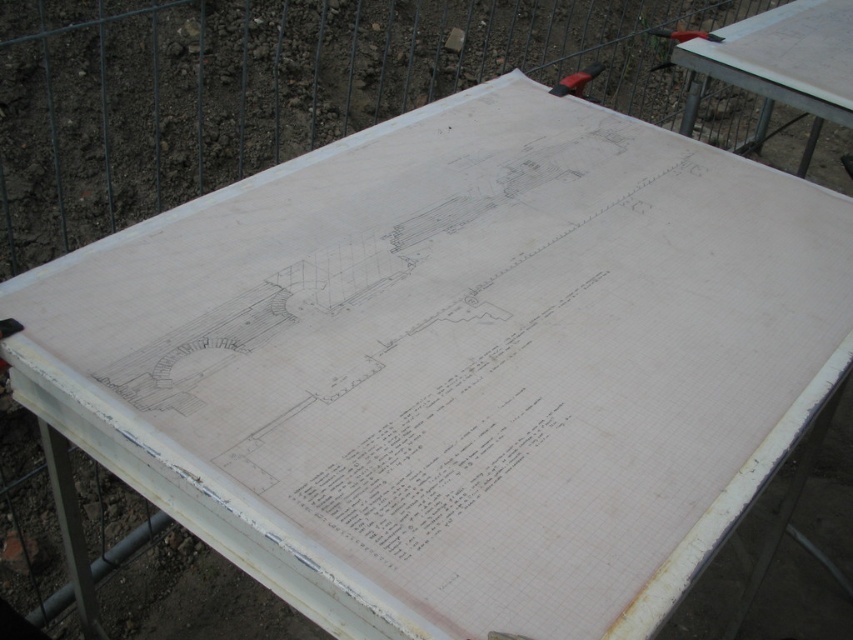
Question: Among these objects, which one is farthest from the camera?

Choices:
 (A) metallic red hammer at upper right
 (B) white paper at upper right

Answer: (A)

Question: Among these objects, which one is farthest from the camera?

Choices:
 (A) metallic red hammer at upper right
 (B) white paper at upper right

Answer: (A)

Question: Can you confirm if white paper at upper right is positioned above metallic red hammer at upper right?

Choices:
 (A) yes
 (B) no

Answer: (B)

Question: Considering the relative positions of white paper at upper right and metallic red hammer at upper right in the image provided, where is white paper at upper right located with respect to metallic red hammer at upper right?

Choices:
 (A) right
 (B) left

Answer: (A)

Question: Does white paper at upper right appear under metallic red hammer at upper right?

Choices:
 (A) yes
 (B) no

Answer: (A)